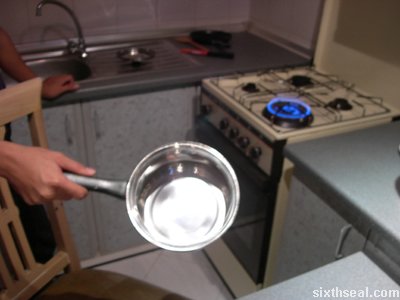
Locate an element on the screen. stove burner is located at coordinates (251, 86), (303, 77), (341, 102), (289, 110).